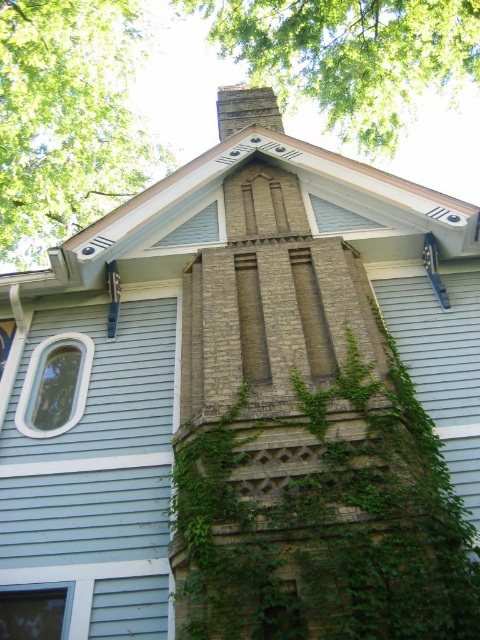
Question: Which point appears farthest from the camera in this image?

Choices:
 (A) (13, 637)
 (B) (24, 232)
 (C) (251, 108)

Answer: (B)

Question: Does green leafy tree at upper center have a larger size compared to brown brick chimney at upper center?

Choices:
 (A) yes
 (B) no

Answer: (B)

Question: Which of the following is the farthest from the observer?

Choices:
 (A) (236, 90)
 (B) (347, 42)

Answer: (A)

Question: Can you confirm if white plastic window at upper left is thinner than brown brick chimney at upper center?

Choices:
 (A) no
 (B) yes

Answer: (B)

Question: Which point appears closest to the camera in this image?

Choices:
 (A) (220, 104)
 (B) (1, 636)
 (C) (31, 371)
 (D) (33, 104)

Answer: (B)

Question: Can you confirm if green leafy tree at upper left is positioned above clear glass window at lower left?

Choices:
 (A) no
 (B) yes

Answer: (B)